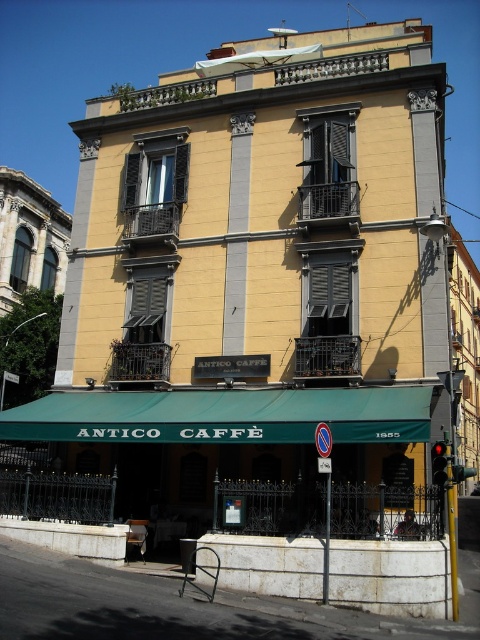
Who is lower down, black matte shutters at center or black matte shutter at center?

black matte shutters at center

Can you confirm if black matte shutters at center is positioned to the left of black matte shutter at center?

Indeed, black matte shutters at center is positioned on the left side of black matte shutter at center.

Locate an element on the screen. The image size is (480, 640). black matte shutters at center is located at coordinates (327, 320).